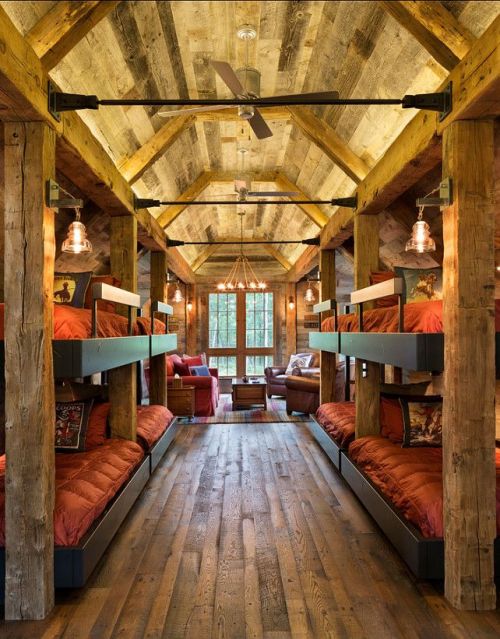
You are a GUI agent. You are given a task and a screenshot of the screen. Output one action in this format:
    pyautogui.click(x=<x>, y=<y>)
    Task: Click on the fan
    
    Given the screenshot: What is the action you would take?
    pyautogui.click(x=246, y=91)